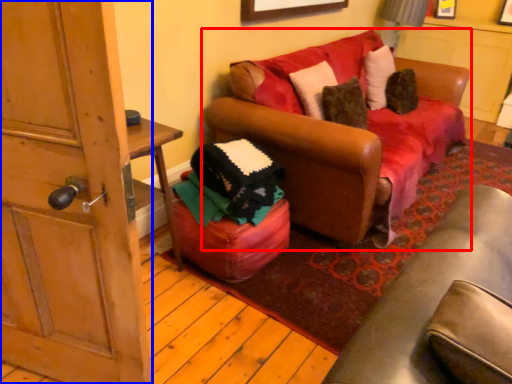
Question: Which object appears closest to the camera in this image, studio couch (highlighted by a red box) or door (highlighted by a blue box)?

Choices:
 (A) studio couch
 (B) door

Answer: (B)